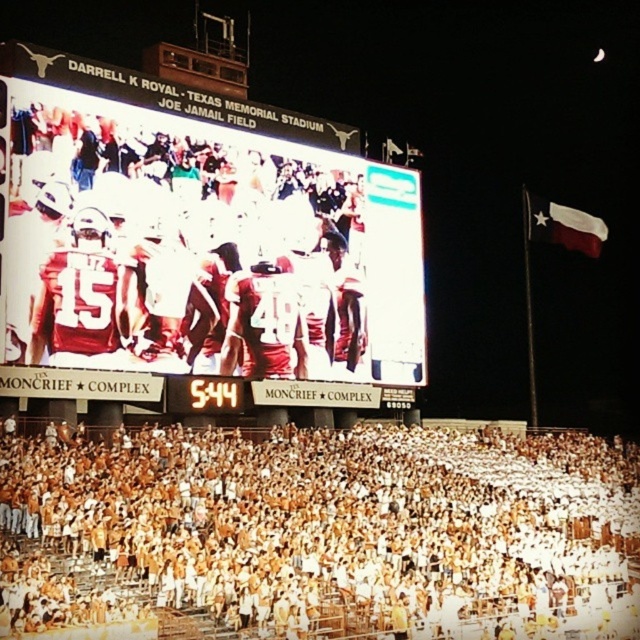
Question: Which object is the farthest from the white fabric flag at upper right?

Choices:
 (A) white digital scoreboard at upper center
 (B) white fabric crowd at lower center

Answer: (B)

Question: Is white fabric crowd at lower center smaller than white fabric flag at upper right?

Choices:
 (A) no
 (B) yes

Answer: (A)

Question: Is white digital scoreboard at upper center to the left of white fabric flag at upper right from the viewer's perspective?

Choices:
 (A) yes
 (B) no

Answer: (A)

Question: Is white digital scoreboard at upper center to the left of white fabric flag at upper right from the viewer's perspective?

Choices:
 (A) yes
 (B) no

Answer: (A)

Question: Which of the following is the farthest from the observer?

Choices:
 (A) white fabric flag at upper right
 (B) white digital scoreboard at upper center

Answer: (A)

Question: Among these points, which one is farthest from the camera?

Choices:
 (A) (563, 246)
 (B) (605, 634)

Answer: (A)